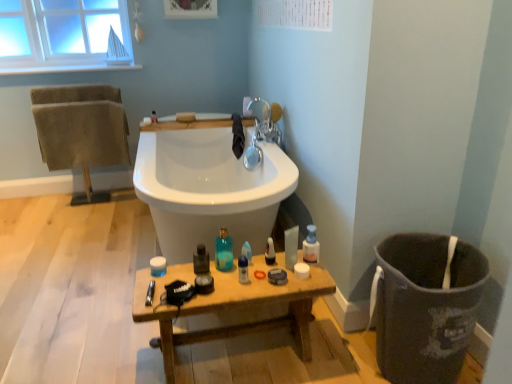
Identify the location of vacant space to the right of translucent glass mouthwash at center, placed as the second mouthwash when sorted from right to left. This screenshot has width=512, height=384. (242, 273).